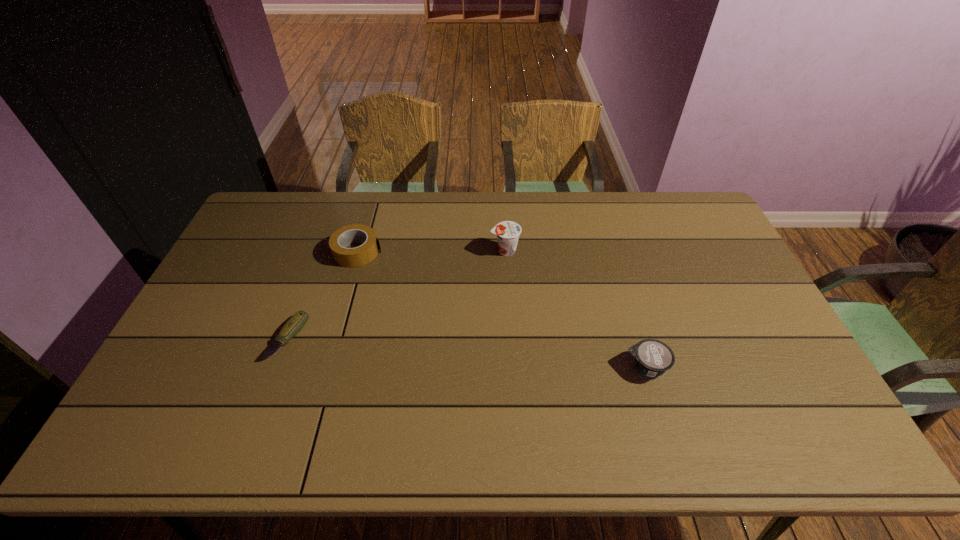
Where is `vacant space that satisfies the following two spatial constraints: 1. at the edge of the second object from left to right; 2. on the front side of the pocketknife`? This screenshot has width=960, height=540. vacant space that satisfies the following two spatial constraints: 1. at the edge of the second object from left to right; 2. on the front side of the pocketknife is located at coordinates (333, 338).